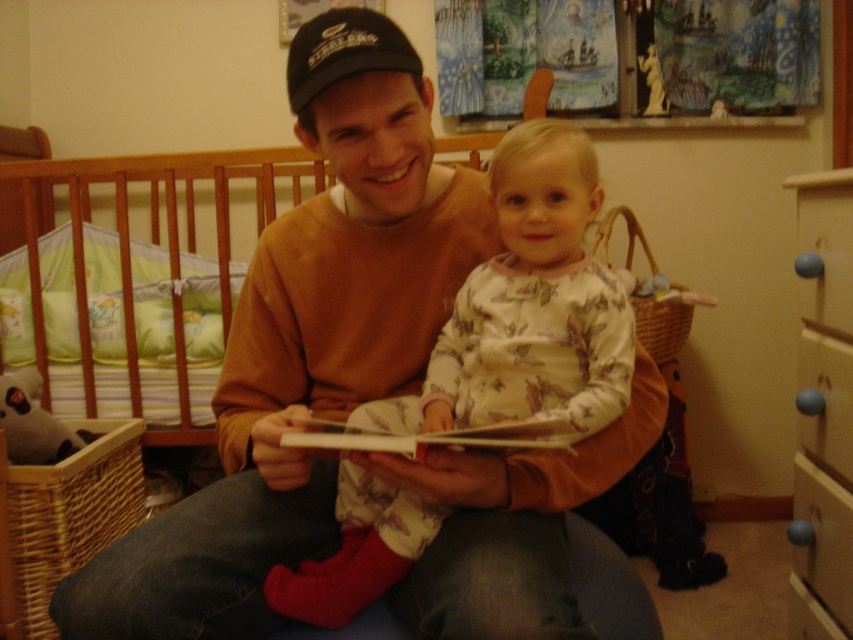
You are designing a nursery and want to place a large toy box where the green fabric crib at left is currently located. Since the black fabric baseball cap at upper center is above it, will the toy box block the view of the cap?

The green fabric crib at left is larger in size than the black fabric baseball cap at upper center. However, since the cap is positioned above the crib, moving the crib to place the toy box might not necessarily block the view unless the toy box is taller. The description only mentions size, not height. Therefore, the view of the cap could still be visible unless the toy box exceeds the cap in height.

You are a parent preparing to dress your baby. You have a fluffy white onesie at center and a blue plastic drawer at lower right. Which item is wider?

The fluffy white onesie at center is wider than the blue plastic drawer at lower right.

You are a photographer setting up a shoot in this room. You need to position a small tripod between the green fabric crib at left and the black fabric baseball cap at upper center. Since you want the tripod to be as close as possible to the taller object, which object should you place it near?

The green fabric crib at left is taller than the black fabric baseball cap at upper center, so you should place the tripod near the green fabric crib at left.